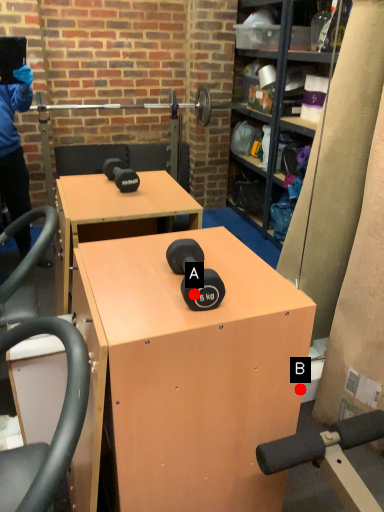
Question: Two points are circled on the image, labeled by A and B beside each circle. Among these points, which one is farthest from the camera?

Choices:
 (A) A is further
 (B) B is further

Answer: (B)